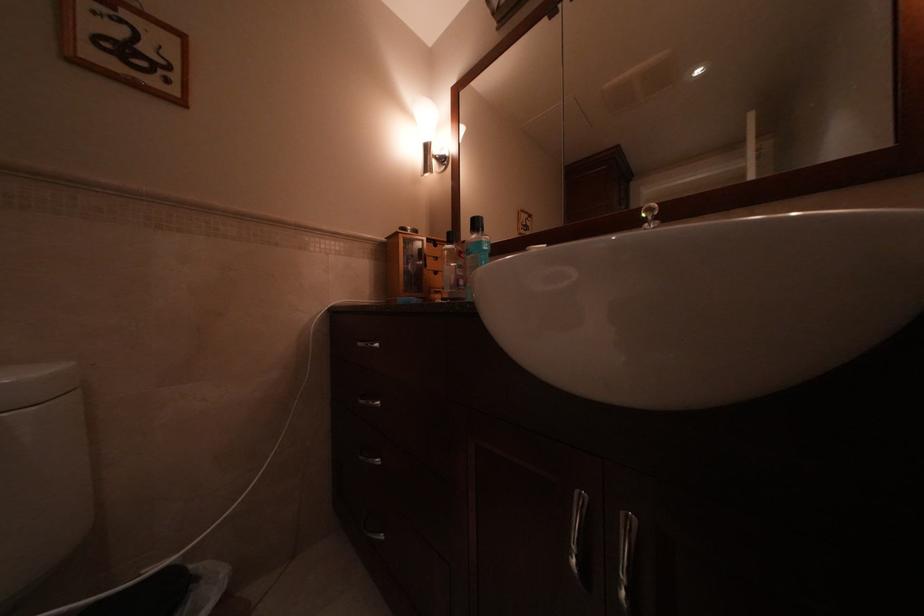
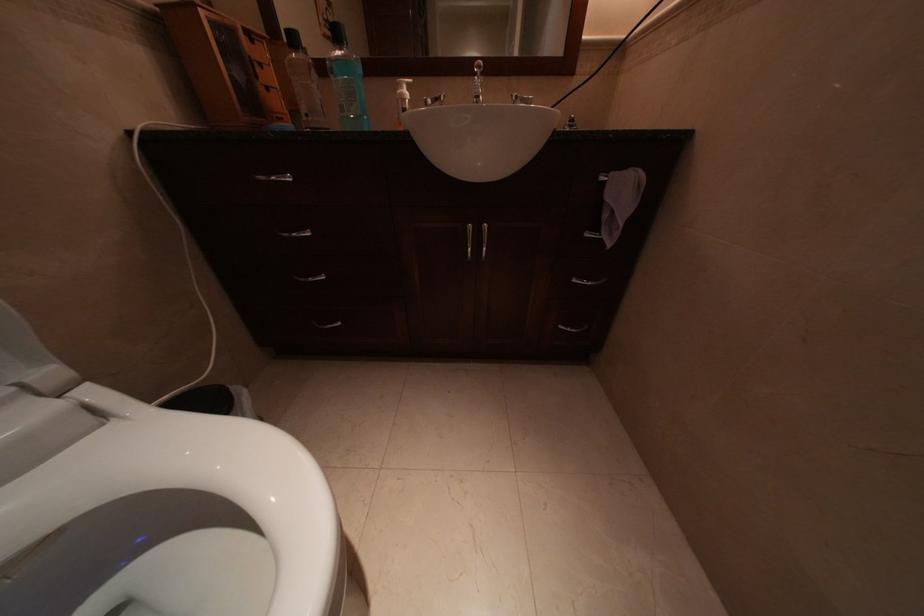
The images are taken continuously from a first-person perspective. In which direction is your viewpoint rotating?

The rotation direction of the camera is right-down.